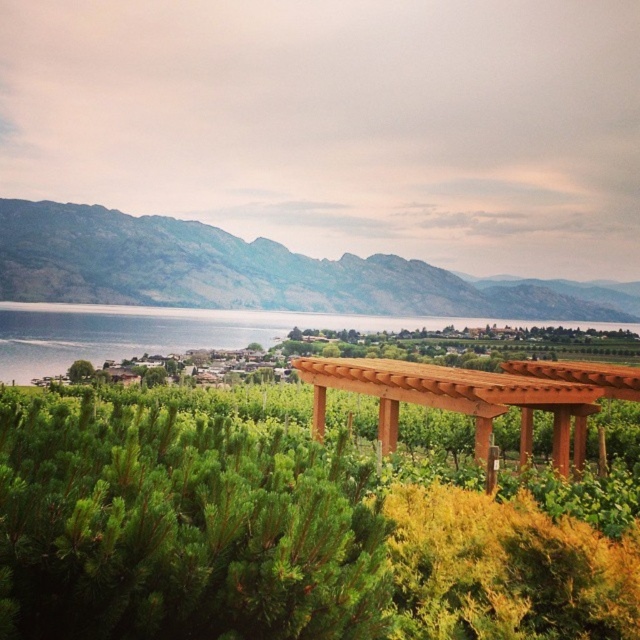
You are planning to install a new pergola in your backyard. You have a space that can accommodate structures up to the size of the green leafy tree at lower left. Based on the scene, will the brown wooden pergola at center fit in your space?

The brown wooden pergola at center is larger than the green leafy tree at lower left, so it will not fit in the space allocated for the size of the green leafy tree at lower left.